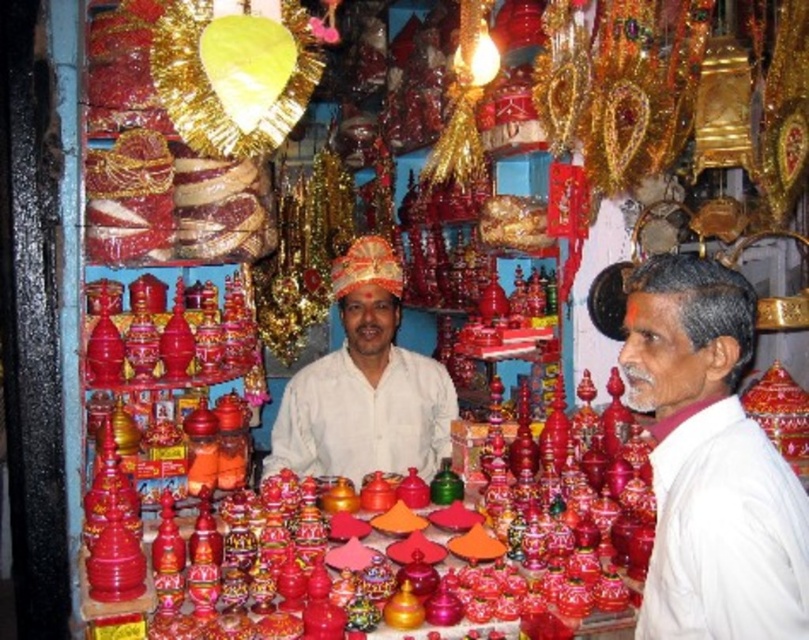
You are standing in the market scene described. There is a point labeled at coordinates (710, 461). What object is located at that point?

The point at coordinates (710, 461) corresponds to the white matte shirt at right.

You are a customer in the market and want to pick up the white matte shirt at right. Based on its position, is it placed on the table or on a shelf?

The white matte shirt at right is located at point (710, 461), which corresponds to the foreground table area. Therefore, it is placed on the table.